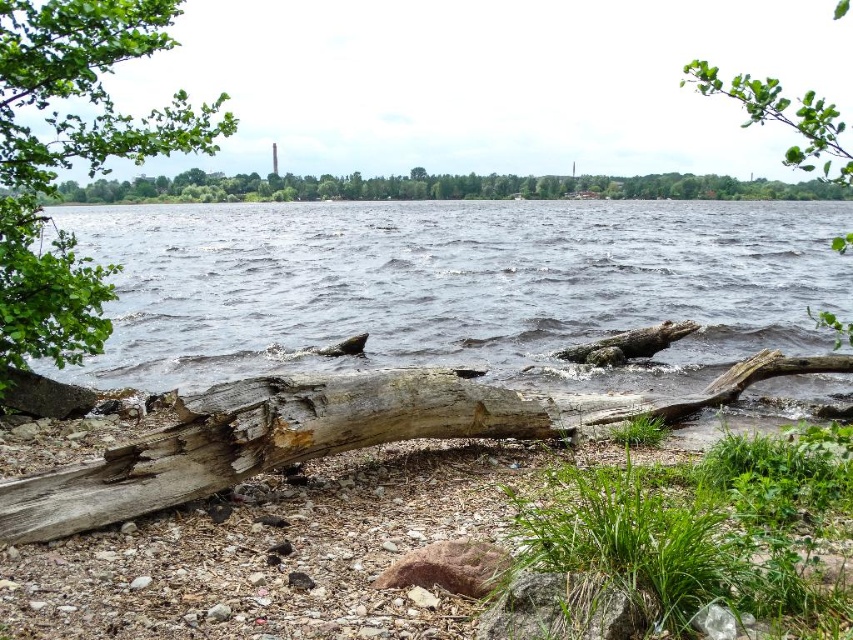
Does dark blue water at center have a lesser height compared to weathered wood log at center?

In fact, dark blue water at center may be taller than weathered wood log at center.

Consider the image. Measure the distance between dark blue water at center and weathered wood log at center.

They are 26.69 feet apart.

Describe the element at coordinates (456, 285) in the screenshot. I see `dark blue water at center` at that location.

Identify the location of dark blue water at center. (456, 285).

Image resolution: width=853 pixels, height=640 pixels. What are the coordinates of `weathered wood log at lower center` in the screenshot? It's located at [x=328, y=433].

Is weathered wood log at lower center smaller than green leafy tree at upper center?

Correct, weathered wood log at lower center occupies less space than green leafy tree at upper center.

Where is `weathered wood log at lower center`? This screenshot has width=853, height=640. weathered wood log at lower center is located at coordinates (328, 433).

Is weathered wood log at lower center shorter than weathered wood log at center?

Yes, weathered wood log at lower center is shorter than weathered wood log at center.

Who is more distant from viewer, (x=409, y=394) or (x=599, y=342)?

Positioned behind is point (x=599, y=342).

Find the location of a particular element. This screenshot has height=640, width=853. weathered wood log at lower center is located at coordinates (328, 433).